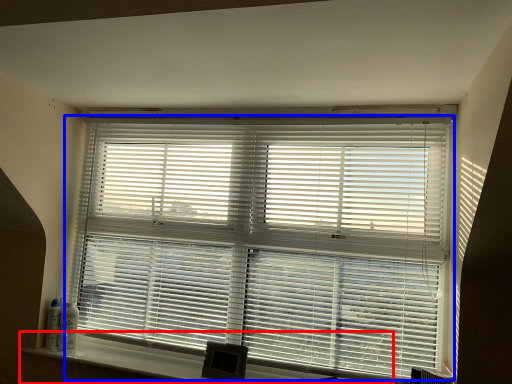
Question: Which of the following is the closest to the observer, window sill (highlighted by a red box) or window blind (highlighted by a blue box)?

Choices:
 (A) window sill
 (B) window blind

Answer: (A)